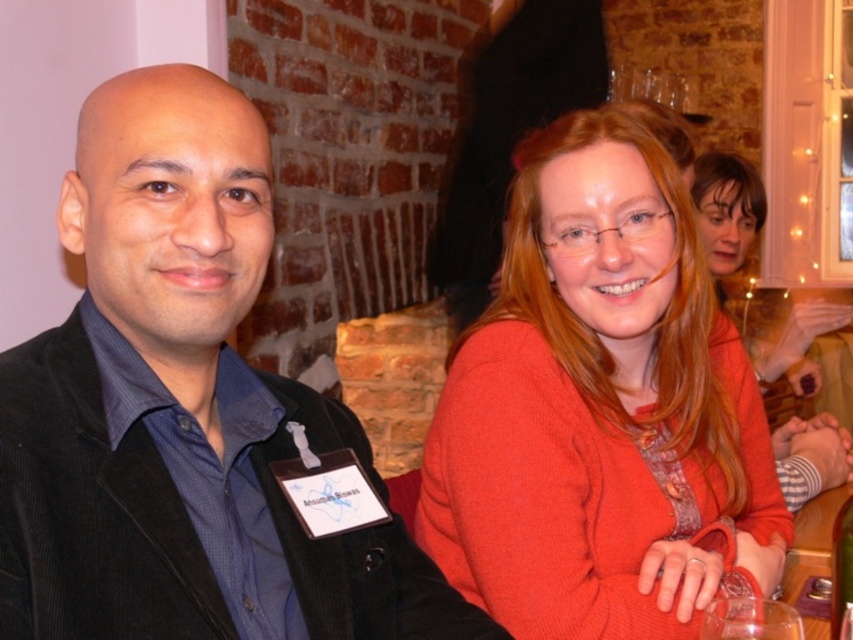
Which of these two, black corduroy jacket at left or transparent glass at lower right, stands taller?

With more height is black corduroy jacket at left.

Can you confirm if black corduroy jacket at left is positioned to the left of transparent glass at lower right?

Correct, you'll find black corduroy jacket at left to the left of transparent glass at lower right.

Which is in front, point (305, 412) or point (788, 611)?

Positioned in front is point (788, 611).

At what (x,y) coordinates should I click in order to perform the action: click on black corduroy jacket at left. Please return your answer as a coordinate pair (x, y). The image size is (853, 640). Looking at the image, I should click on (178, 406).

Can you confirm if matte orange sweater at center is positioned to the left of transparent plastic bottle at lower right?

Indeed, matte orange sweater at center is positioned on the left side of transparent plastic bottle at lower right.

Does point (556, 282) lie in front of point (851, 563)?

No, it is behind (851, 563).

Who is more distant from viewer, (x=706, y=394) or (x=842, y=566)?

Positioned behind is point (x=706, y=394).

The image size is (853, 640). I want to click on matte orange sweater at center, so click(x=598, y=408).

Measure the distance between black corduroy jacket at left and camera.

black corduroy jacket at left and camera are 57.45 centimeters apart.

Which is above, black corduroy jacket at left or matte orange sweater at center?

matte orange sweater at center is higher up.

Where is `black corduroy jacket at left`? Image resolution: width=853 pixels, height=640 pixels. black corduroy jacket at left is located at coordinates (178, 406).

This screenshot has width=853, height=640. I want to click on black corduroy jacket at left, so click(x=178, y=406).